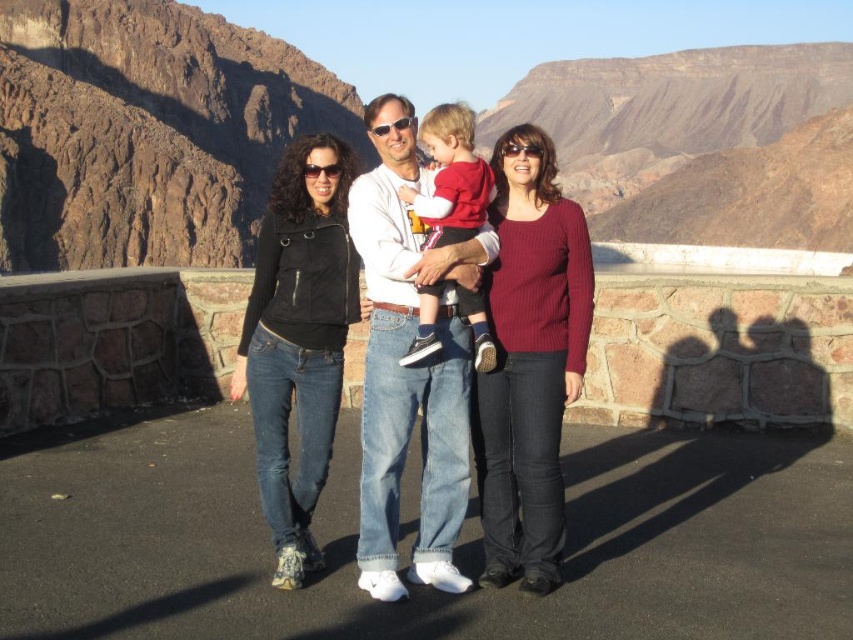
Question: Which point is closer to the camera?

Choices:
 (A) rugged rock formation at upper left
 (B) white cotton shirt at center
 (C) ribbed sweater at center
 (D) black leather jacket at center

Answer: (B)

Question: Which object is the farthest from the rugged rock formation at upper center?

Choices:
 (A) ribbed sweater at center
 (B) black leather jacket at center
 (C) rugged rock formation at upper left
 (D) matte red sweater at center

Answer: (D)

Question: Which point is farther from the camera taking this photo?

Choices:
 (A) (393, 260)
 (B) (543, 264)
 (C) (419, 280)

Answer: (B)

Question: Is rugged rock formation at upper center positioned behind matte black jacket at center?

Choices:
 (A) yes
 (B) no

Answer: (A)

Question: Does rugged rock formation at upper left have a greater width compared to white cotton shirt at center?

Choices:
 (A) no
 (B) yes

Answer: (B)

Question: Does rugged rock formation at upper center have a lesser width compared to rugged rock formation at upper left?

Choices:
 (A) no
 (B) yes

Answer: (A)